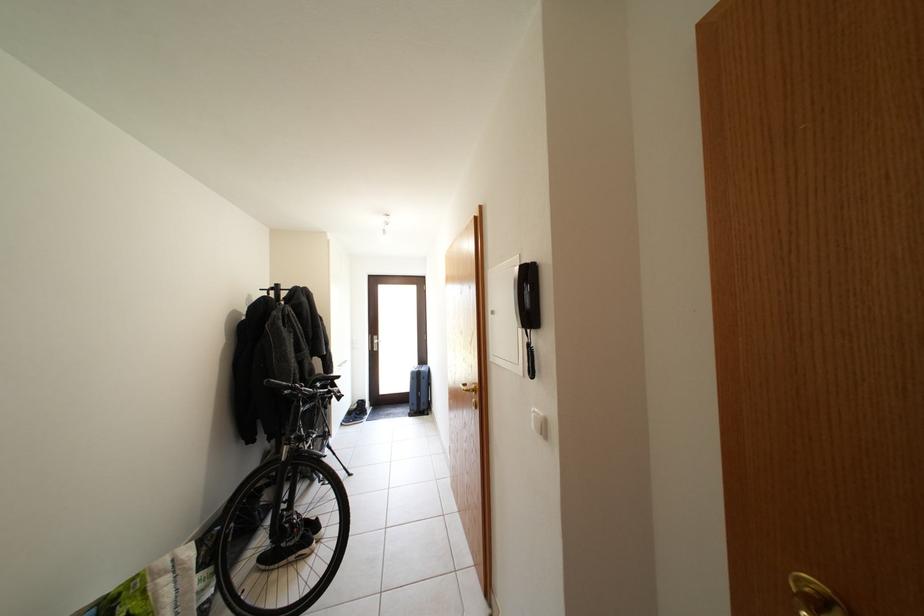
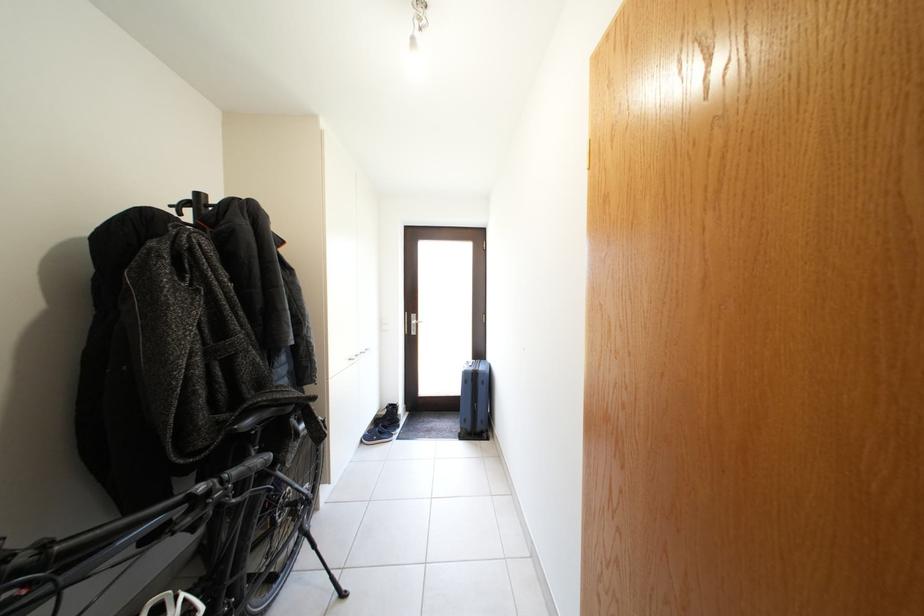
In the second image, find the point that corresponds to pixel 286 291 in the first image.

(205, 200)